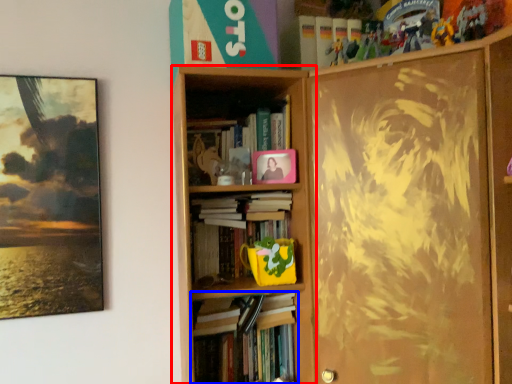
Question: Which of the following is the closest to the observer, bookcase (highlighted by a red box) or book (highlighted by a blue box)?

Choices:
 (A) bookcase
 (B) book

Answer: (A)